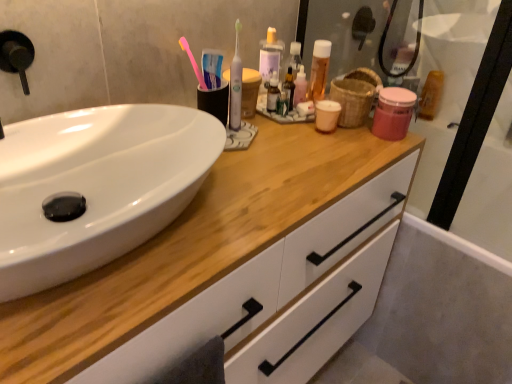
Question: From the image's perspective, would you say bamboo basket at upper right is positioned over translucent plastic mouthwash at upper right, acting as the 3th mouthwash starting from the left?

Choices:
 (A) no
 (B) yes

Answer: (A)

Question: Is bamboo basket at upper right not inside translucent plastic mouthwash at upper right, the 3th mouthwash positioned from the front?

Choices:
 (A) yes
 (B) no

Answer: (A)

Question: Considering the relative sizes of bamboo basket at upper right and translucent plastic mouthwash at upper right, acting as the 3th mouthwash starting from the left, in the image provided, is bamboo basket at upper right bigger than translucent plastic mouthwash at upper right, acting as the 3th mouthwash starting from the left,?

Choices:
 (A) yes
 (B) no

Answer: (A)

Question: Does bamboo basket at upper right appear on the left side of translucent plastic mouthwash at upper right, which ranks as the 1th mouthwash in right-to-left order?

Choices:
 (A) yes
 (B) no

Answer: (A)

Question: Is bamboo basket at upper right with translucent plastic mouthwash at upper right, acting as the 3th mouthwash starting from the left?

Choices:
 (A) no
 (B) yes

Answer: (A)

Question: Considering the relative sizes of bamboo basket at upper right and translucent plastic mouthwash at upper right, the 3th mouthwash positioned from the front, in the image provided, is bamboo basket at upper right shorter than translucent plastic mouthwash at upper right, the 3th mouthwash positioned from the front,?

Choices:
 (A) no
 (B) yes

Answer: (B)

Question: Can you confirm if translucent plastic mouthwash at center, which appears as the 2th mouthwash when viewed from the front, is positioned to the left of translucent plastic mouthwash at upper right, the 3th mouthwash positioned from the front?

Choices:
 (A) yes
 (B) no

Answer: (A)

Question: Is translucent plastic mouthwash at center, which appears as the 2th mouthwash when viewed from the front, not within translucent plastic mouthwash at upper right, the 3th mouthwash positioned from the front?

Choices:
 (A) yes
 (B) no

Answer: (A)

Question: Considering the relative sizes of translucent plastic mouthwash at center, which appears as the 2th mouthwash when viewed from the front, and translucent plastic mouthwash at upper right, acting as the 3th mouthwash starting from the left, in the image provided, is translucent plastic mouthwash at center, which appears as the 2th mouthwash when viewed from the front, bigger than translucent plastic mouthwash at upper right, acting as the 3th mouthwash starting from the left,?

Choices:
 (A) yes
 (B) no

Answer: (B)

Question: From a real-world perspective, is translucent plastic mouthwash at center, the third mouthwash viewed from the right, positioned over translucent plastic mouthwash at upper right, which ranks as the 1th mouthwash in right-to-left order, based on gravity?

Choices:
 (A) no
 (B) yes

Answer: (B)

Question: Considering the relative sizes of translucent plastic mouthwash at center, the 2th mouthwash from the back, and translucent plastic mouthwash at upper right, the first mouthwash when ordered from back to front, in the image provided, is translucent plastic mouthwash at center, the 2th mouthwash from the back, shorter than translucent plastic mouthwash at upper right, the first mouthwash when ordered from back to front,?

Choices:
 (A) yes
 (B) no

Answer: (A)

Question: Is translucent plastic mouthwash at center, which appears as the 2th mouthwash when viewed from the front, further to the viewer compared to translucent plastic mouthwash at upper right, the first mouthwash when ordered from back to front?

Choices:
 (A) yes
 (B) no

Answer: (B)

Question: Can you confirm if white glossy sink at left is smaller than bamboo basket at upper right?

Choices:
 (A) yes
 (B) no

Answer: (B)